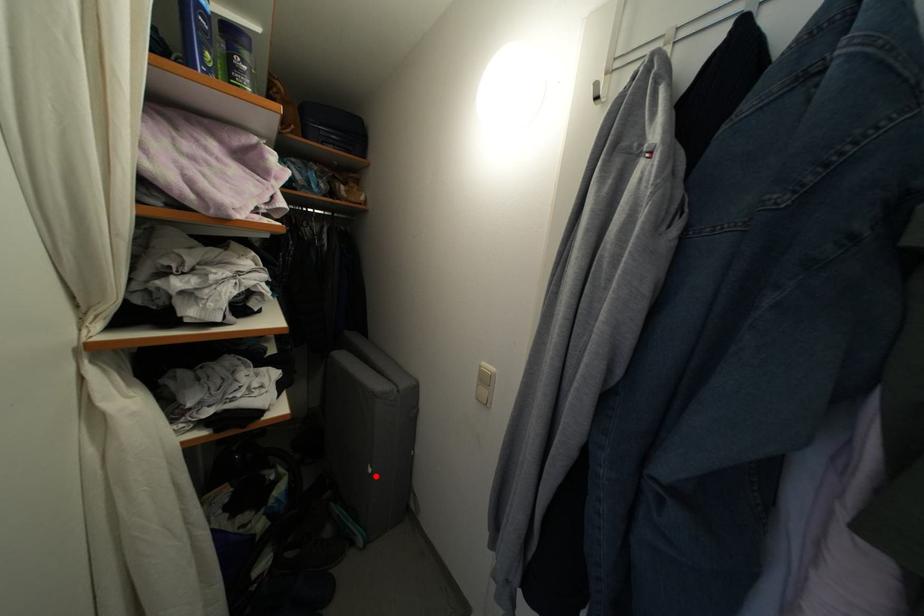
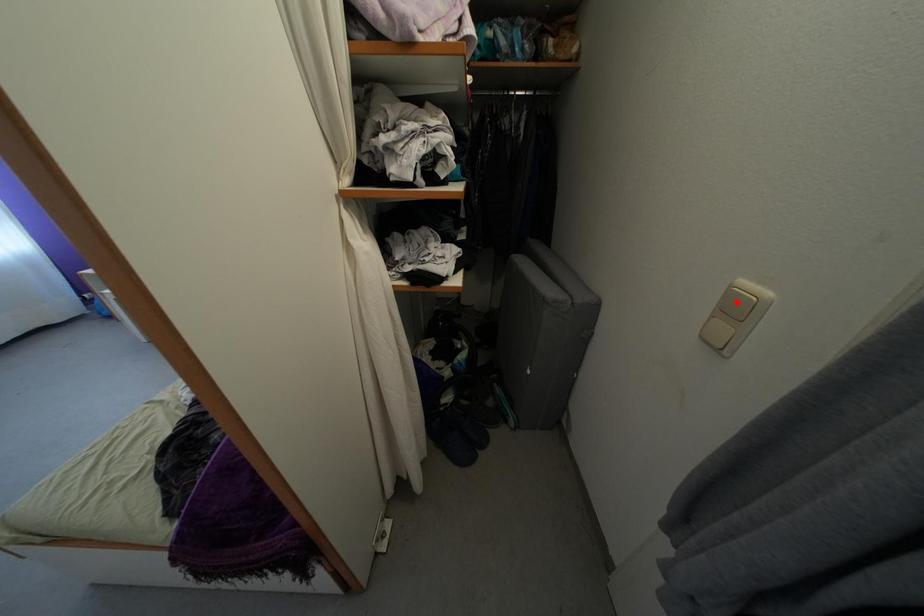
From the picture: I am providing you with two images of the same scene from different viewpoints. A red point is marked on the first image and another point is marked on the second image. Is the marked point in image1 the same physical position as the marked point in image2?

No